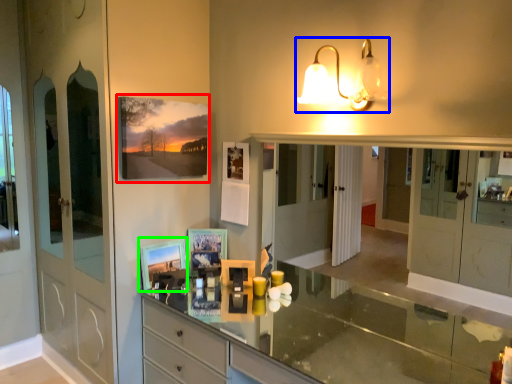
Question: Which object is the closest to the picture frame (highlighted by a red box)? Choose among these: lamp (highlighted by a blue box) or picture frame (highlighted by a green box).

Choices:
 (A) lamp
 (B) picture frame

Answer: (B)